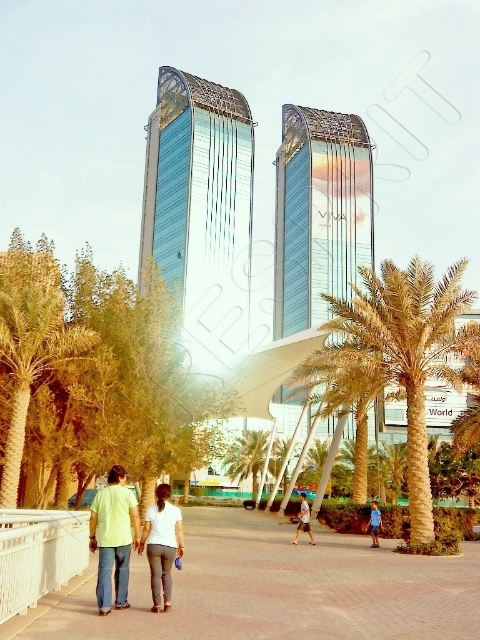
You are a city planner evaluating the urban space. You need to place a bench along the paved brick sidewalk at center. Considering the size of the golden textured palm tree at center, will the bench fit comfortably without obstructing the tree?

The paved brick sidewalk at center is smaller than the golden textured palm tree at center. Since the sidewalk is narrower than the tree, placing a bench might not leave enough space for the tree. Ensure the bench is placed in a way that accommodates both the tree and the sidewalk width.

You are a city planner assessing the walkway between the two skyscrapers. You notice the golden textured palm tree at center and the green leafy palm tree at left. Which of these two palm trees is larger in size?

The golden textured palm tree at center is bigger than the green leafy palm tree at left.

You are a photographer standing at the edge of the walkway. You want to take a photo of the light yellow shirt at center and the golden textured palm tree at center in the same frame. Considering the distance between them, will you be able to capture both in a single shot without moving your position?

The golden textured palm tree at center is 16.56 meters away from the light yellow shirt at center. Depending on your camera lens, if it has a wide enough angle, you can capture both in one shot without moving. However, if your lens has a narrow angle, you might need to adjust your position or use a different lens.